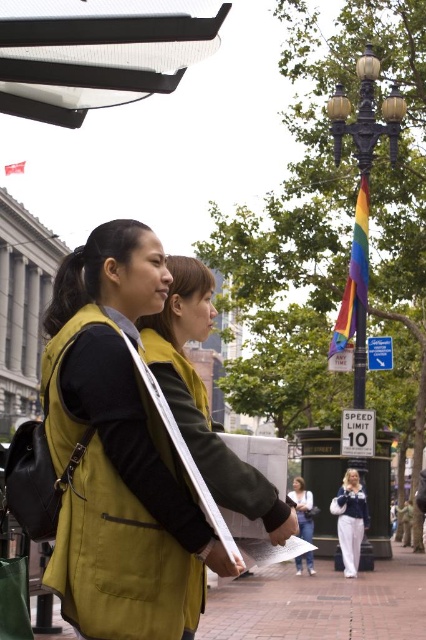
Does brick pavement at lower center appear under metallic black bus stop at center?

Correct, brick pavement at lower center is located below metallic black bus stop at center.

Who is lower down, brick pavement at lower center or metallic black bus stop at center?

brick pavement at lower center

Who is more distant from viewer, (423, 634) or (336, 525)?

The point (336, 525) is more distant.

This screenshot has height=640, width=426. What are the coordinates of `brick pavement at lower center` in the screenshot? It's located at (321, 604).

Does brick pavement at lower center come behind white matte jacket at center?

No, brick pavement at lower center is in front of white matte jacket at center.

Is point (221, 600) more distant than point (362, 492)?

No.

Image resolution: width=426 pixels, height=640 pixels. Identify the location of brick pavement at lower center. (321, 604).

Is point (385, 440) positioned behind point (345, 508)?

Yes, point (385, 440) is farther from viewer.

Is the position of metallic black bus stop at center more distant than that of white matte jacket at center?

No.

Who is more forward, (377,451) or (356,476)?

Positioned in front is point (356,476).

At what (x,y) coordinates should I click in order to perform the action: click on metallic black bus stop at center. Please return your answer as a coordinate pair (x, y). Looking at the image, I should click on (322, 481).